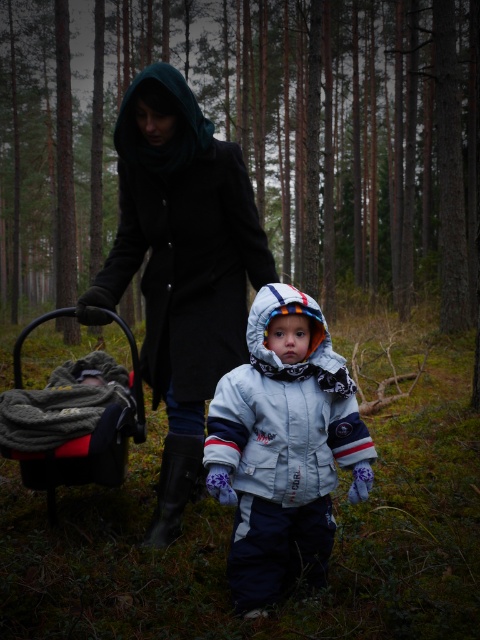
You are a photographer standing in the forest scene. You want to take a photo that includes both the point at coordinates (450, 253) and the point at coordinates (235, 596). Which point should you focus on first to ensure both are in focus?

You should focus on point (235, 596) first because it is closer to the camera than point (450, 253). By focusing on the closer point, the farther point will also be within the depth of field, ensuring both are in focus.

Based on the scene description and the position of the light gray fleece snowsuit at center, what is the exact coordinate of the snowsuit?

The light gray fleece snowsuit at center is located at the 2D coordinate point of (284, 448).